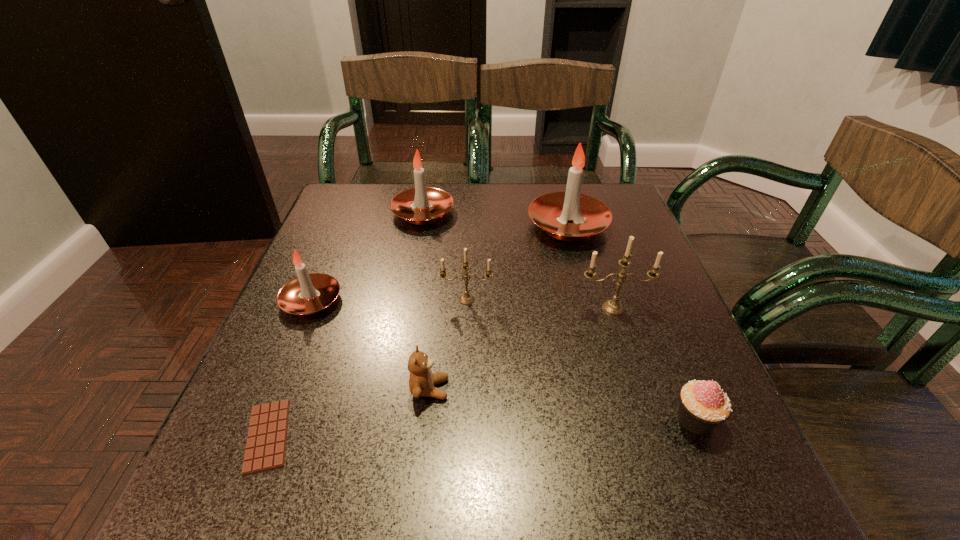
Where is `candle object that ranks as the third closest to the biggest white candle`? The image size is (960, 540). candle object that ranks as the third closest to the biggest white candle is located at coordinates (421, 205).

Locate an element on the screen. This screenshot has width=960, height=540. candle that is the fourth closest one to the tallest candle is located at coordinates (308, 294).

I want to click on white candle identified as the second closest to the leftmost white candle, so click(x=553, y=212).

This screenshot has height=540, width=960. In order to click on white candle that stands as the closest to the tallest candle in this screenshot , I will do `click(421, 205)`.

This screenshot has height=540, width=960. Identify the location of free region that satisfies the following two spatial constraints: 1. on the front side of the smaller metallic candle; 2. on the left side of the second white candle from left to right. (407, 300).

In order to click on free space that satisfies the following two spatial constraints: 1. on the front side of the tallest object; 2. on the front-facing side of the teddy bear in this screenshot , I will do `click(612, 389)`.

At what (x,y) coordinates should I click in order to perform the action: click on vacant point that satisfies the following two spatial constraints: 1. on the back side of the smallest white candle; 2. on the right side of the left metallic candle. Please return your answer as a coordinate pair (x, y). The height and width of the screenshot is (540, 960). Looking at the image, I should click on click(x=312, y=300).

Where is `free spot that satisfies the following two spatial constraints: 1. on the front side of the candy bar; 2. on the right side of the leftmost candle`? This screenshot has height=540, width=960. free spot that satisfies the following two spatial constraints: 1. on the front side of the candy bar; 2. on the right side of the leftmost candle is located at coordinates (256, 436).